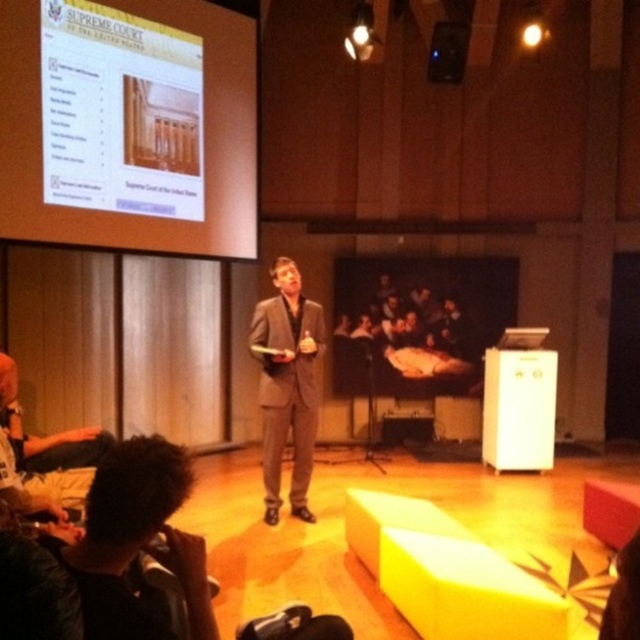
Question: Which point is farther to the camera?

Choices:
 (A) white glossy projection screen at upper left
 (B) matte gray suit at center

Answer: (B)

Question: Can you confirm if white glossy projection screen at upper left is smaller than matte gray suit at center?

Choices:
 (A) yes
 (B) no

Answer: (B)

Question: Among these objects, which one is farthest from the camera?

Choices:
 (A) matte gray suit at center
 (B) white glossy projection screen at upper left

Answer: (A)

Question: Considering the relative positions of white glossy projection screen at upper left and matte gray suit at center in the image provided, where is white glossy projection screen at upper left located with respect to matte gray suit at center?

Choices:
 (A) above
 (B) below

Answer: (A)

Question: Which point is closer to the camera taking this photo?

Choices:
 (A) (250, 321)
 (B) (13, 209)

Answer: (B)

Question: Does white glossy projection screen at upper left appear under matte gray suit at center?

Choices:
 (A) no
 (B) yes

Answer: (A)